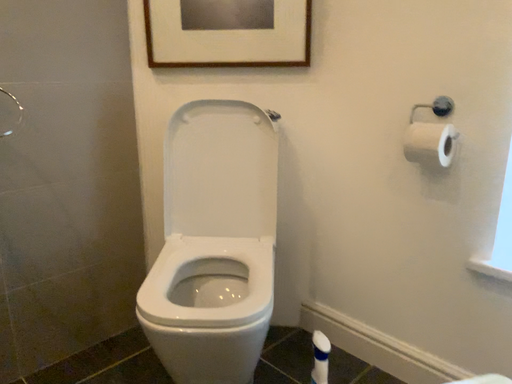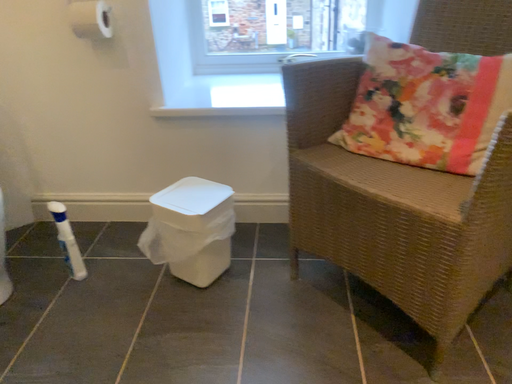
Question: How did the camera likely rotate when shooting the video?

Choices:
 (A) rotated downward
 (B) rotated upward

Answer: (A)